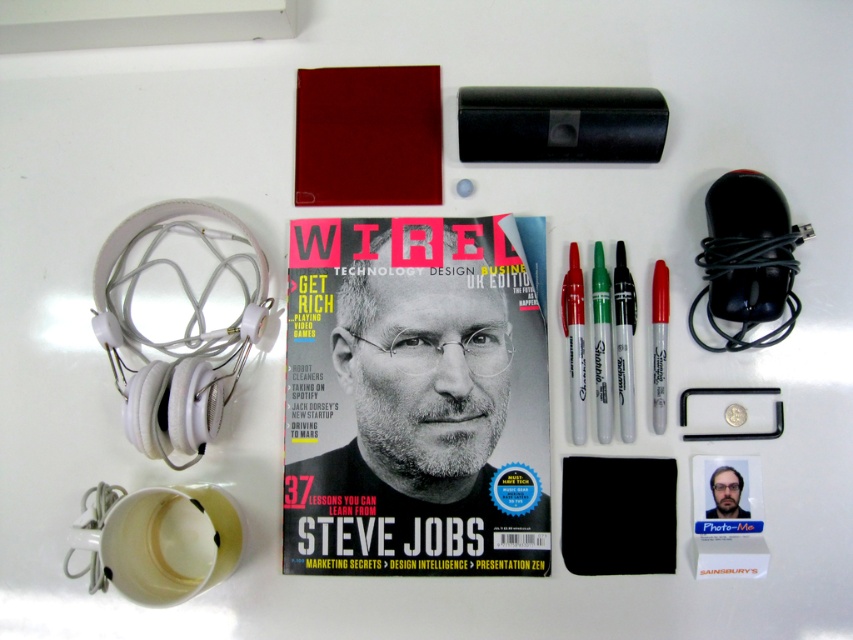
Based on the photo, based on the scene description, what object is located at the coordinates point (415, 400)?

The point (415, 400) indicates the location of the matte paper magazine at center.

You are organizing items on a desk and need to place a new item between the matte paper magazine at center and the silver metallic marker at center. Which side of the magazine should you place the new item to ensure it fits without overlapping?

The matte paper magazine at center is wider than the silver metallic marker at center, so placing the new item on the side of the magazine opposite the marker would ensure it fits without overlapping.

You are organizing items on a desk and need to place a new item between the matte paper magazine at center and the silver metallic marker at center. What is the minimum length of the new item to fit snugly between them without overlapping?

The minimum length of the new item should be 10.81 inches to fit snugly between the matte paper magazine at center and the silver metallic marker at center without overlapping.